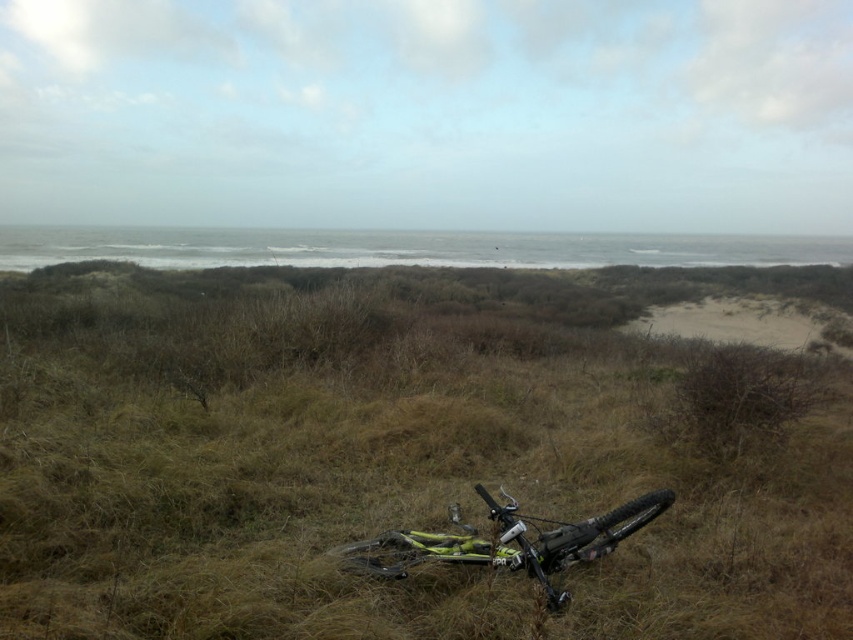
From the picture: You are a hiker who has just arrived at the coastal area. You see the green matte grass at center and the yellow matte bicycle at center. Which object is closer to you?

The green matte grass at center is positioned over the yellow matte bicycle at center, meaning it is closer to you.

You are standing at the origin point of the coordinate system in the image. You want to walk towards the green matte grass at center. In which direction should you move based on the coordinate system provided?

The green matte grass at center is located at coordinate point (405,452). Since the coordinate system typically uses x and y axes where increasing x is to the right and increasing y is downward, you should move towards the right and slightly downward from the origin to reach the green matte grass at center.